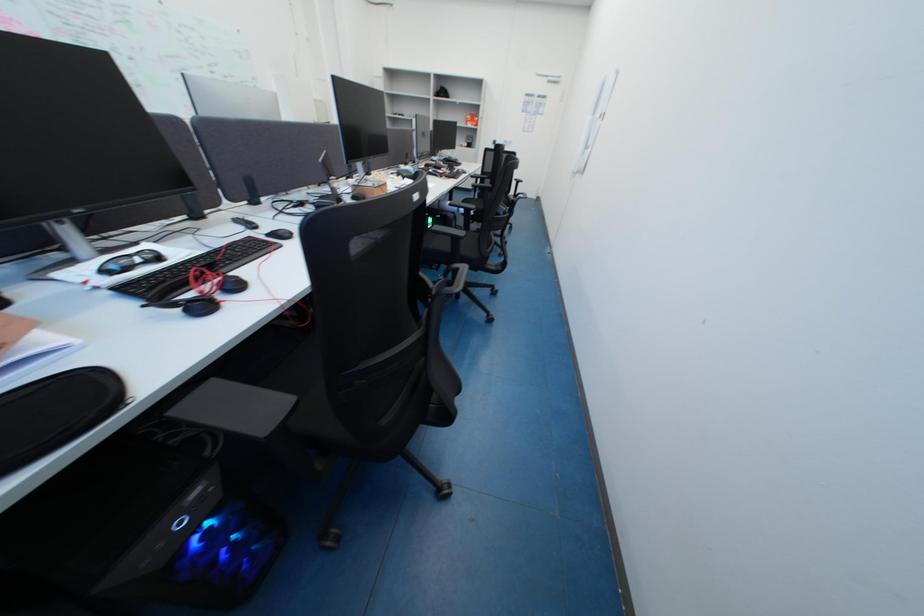
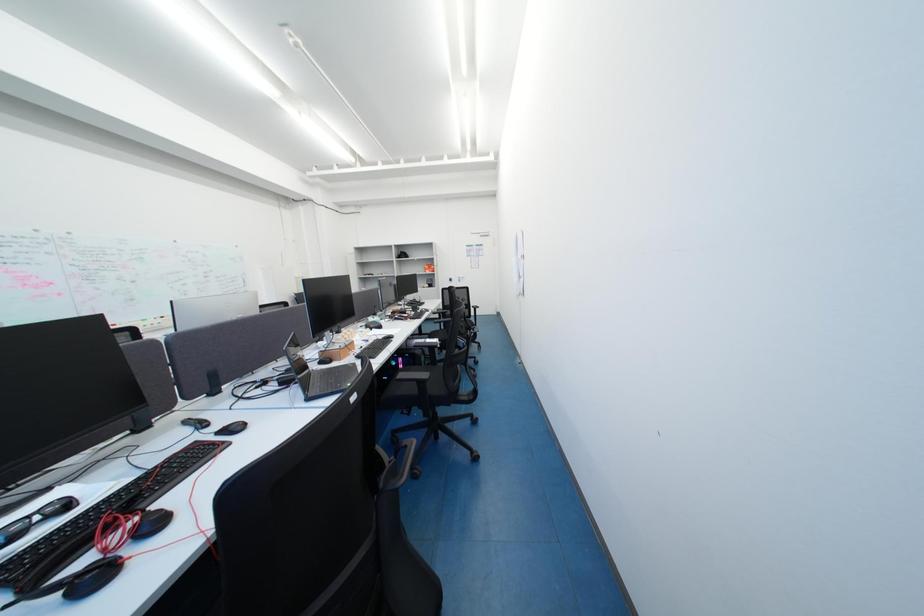
Question: Based on the continuous images, in which direction is the camera rotating? Reply with the corresponding letter.

Choices:
 (A) Left
 (B) Right
 (C) Up
 (D) Down

Answer: (C)